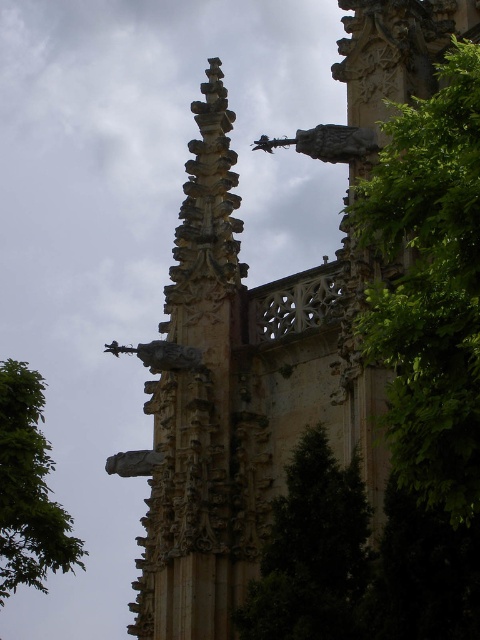
Question: Is green leafy tree at right further to camera compared to polished stone statue at center?

Choices:
 (A) no
 (B) yes

Answer: (A)

Question: Estimate the real-world distances between objects in this image. Which object is closer to the green leafy tree at right?

Choices:
 (A) green leafy tree at left
 (B) polished stone statue at center

Answer: (B)

Question: Which of these objects is positioned farthest from the green leafy tree at left?

Choices:
 (A) green leafy tree at center
 (B) polished stone statue at center

Answer: (A)

Question: Is green leafy tree at right above green leafy tree at left?

Choices:
 (A) yes
 (B) no

Answer: (A)

Question: In this image, where is green leafy tree at center located relative to green leafy tree at left?

Choices:
 (A) above
 (B) below

Answer: (B)

Question: Which is nearer to the green leafy tree at right?

Choices:
 (A) green leafy tree at left
 (B) polished stone statue at center

Answer: (B)